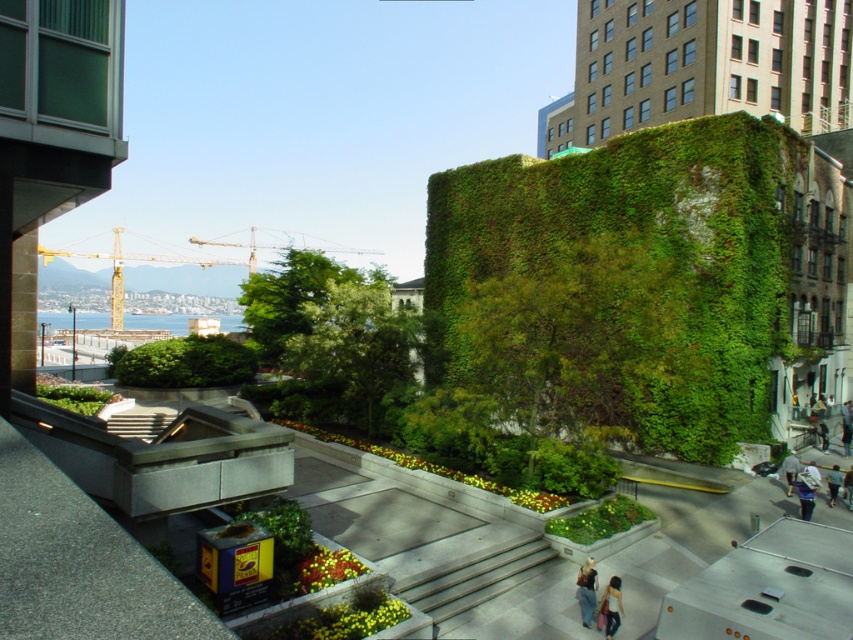
Which is behind, point (200, 280) or point (836, 496)?

The point (200, 280) is more distant.

Where is `yellow metal crane at upper left`? This screenshot has height=640, width=853. yellow metal crane at upper left is located at coordinates (138, 285).

Is point (117, 316) farther from camera compared to point (828, 481)?

Yes.

Locate an element on the screen. The image size is (853, 640). yellow metal crane at upper left is located at coordinates (138, 285).

Find the location of a particular element. The height and width of the screenshot is (640, 853). green leafy tree at center is located at coordinates (351, 352).

Does green leafy tree at center appear under denim jacket at lower center?

Incorrect, green leafy tree at center is not positioned below denim jacket at lower center.

Between point (378, 413) and point (578, 589), which one is positioned in front?

Positioned in front is point (578, 589).

Locate an element on the screen. green leafy tree at center is located at coordinates (351, 352).

Based on the photo, is light beige fabric bag at lower right thinner than dark brown leather jacket at lower right?

No, light beige fabric bag at lower right is not thinner than dark brown leather jacket at lower right.

Is light beige fabric bag at lower right shorter than dark brown leather jacket at lower right?

Indeed, light beige fabric bag at lower right has a lesser height compared to dark brown leather jacket at lower right.

Where is `light beige fabric bag at lower right`? light beige fabric bag at lower right is located at coordinates (611, 608).

The height and width of the screenshot is (640, 853). Find the location of `light beige fabric bag at lower right`. light beige fabric bag at lower right is located at coordinates (611, 608).